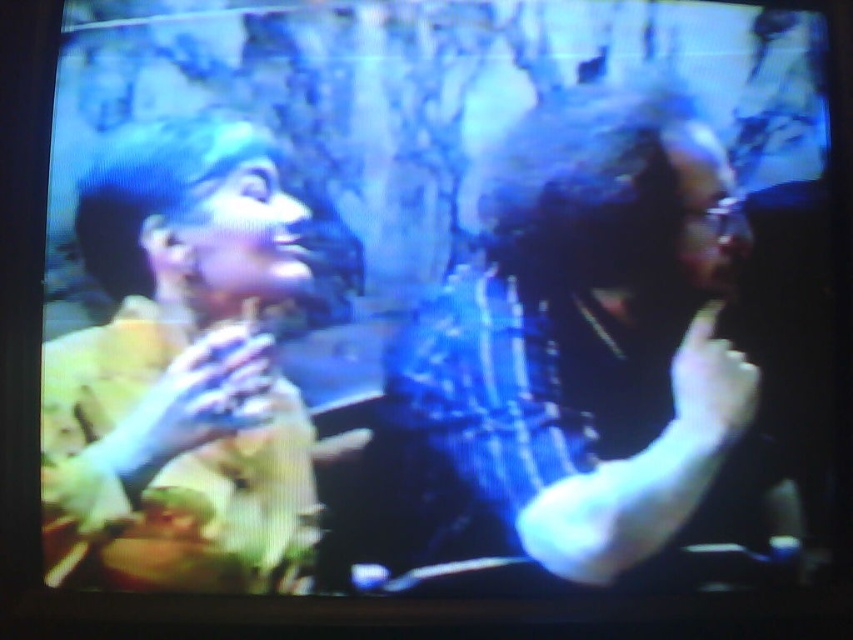
Question: Which object appears closest to the camera in this image?

Choices:
 (A) matte black shirt at center
 (B) yellow fabric at left

Answer: (B)

Question: Considering the relative positions of matte black shirt at center and yellow fabric at left in the image provided, where is matte black shirt at center located with respect to yellow fabric at left?

Choices:
 (A) left
 (B) right

Answer: (B)

Question: Is matte black shirt at center to the left of yellow fabric at left from the viewer's perspective?

Choices:
 (A) yes
 (B) no

Answer: (B)

Question: Is matte black shirt at center further to camera compared to yellow fabric at left?

Choices:
 (A) yes
 (B) no

Answer: (A)

Question: Which point appears farthest from the camera in this image?

Choices:
 (A) (663, 522)
 (B) (97, 468)

Answer: (B)